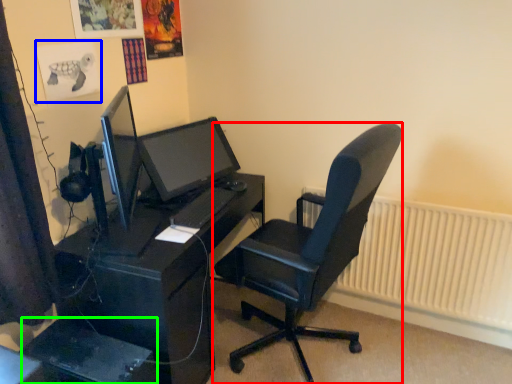
Question: Estimate the real-world distances between objects in this image. Which object is farther from chair (highlighted by a red box), poster page (highlighted by a blue box) or computer tower (highlighted by a green box)?

Choices:
 (A) poster page
 (B) computer tower

Answer: (A)